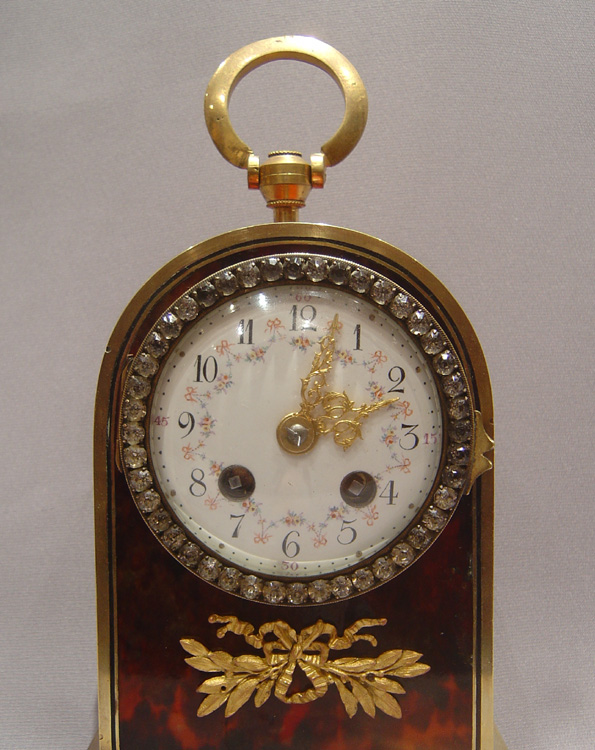
Locate an element on the screen. clock hands is located at coordinates (314, 386), (336, 412).